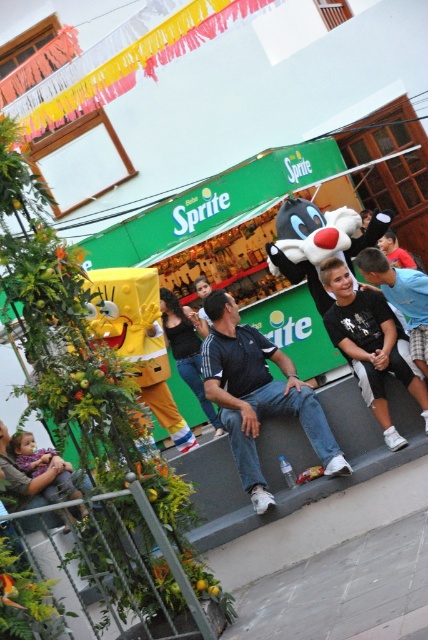
You are standing at the center of the stage and want to place a decoration. There are two points marked on the stage where you can place it. The first point is at coordinates point (225,330) and the second is at point (321,269). Which point is closer to you?

Point (225,330) is closer to the camera than point (321,269), so you should choose that point as it is nearer to your current position on the stage.

You are a photographer at the event and need to take a group photo of the dark blue shirt at center and the plush purple dress at lower left. The camera you have can focus on subjects within a 2.5 meter range. Will both subjects be in focus?

The dark blue shirt at center is 3.04 meters from the plush purple dress at lower left. Since the camera can only focus within 2.5 meters, the distance between them exceeds the focus range. Therefore, both subjects cannot be in focus simultaneously.